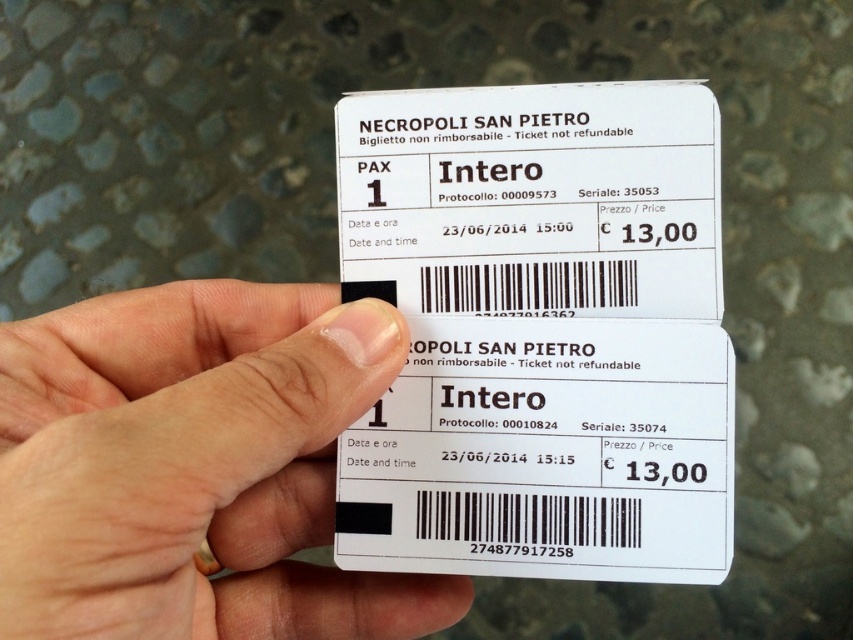
Does white paper ticket at center appear under white matte skin at center?

No.

Which is more to the right, white paper ticket at center or white matte skin at center?

Positioned to the right is white paper ticket at center.

Identify the location of white paper ticket at center. (540, 332).

Find the location of `white paper ticket at center`. white paper ticket at center is located at coordinates (540, 332).